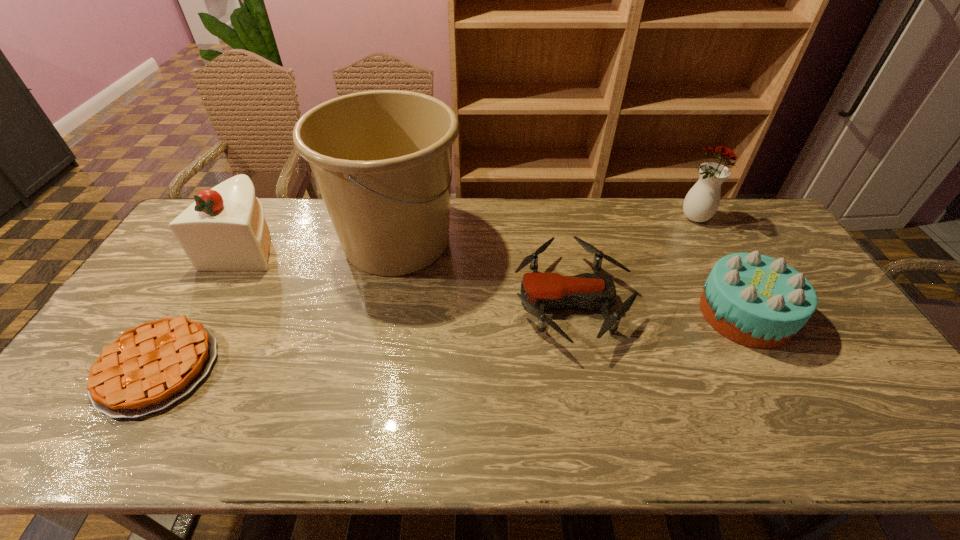
Locate an element on the screen. bucket is located at coordinates (381, 159).

Identify the location of the fourth object from right to left. (381, 159).

Locate an element on the screen. The image size is (960, 540). vase is located at coordinates (702, 201).

Identify the location of the left cake. tap(224, 229).

Locate an element on the screen. the farther cake is located at coordinates (224, 229).

You are a GUI agent. You are given a task and a screenshot of the screen. Output one action in this format:
    pyautogui.click(x=<x>, y=<y>)
    Task: Click on the right cake
    The image size is (960, 540).
    Given the screenshot: What is the action you would take?
    757,301

Locate an element on the screen. the nearer cake is located at coordinates (757, 301).

Image resolution: width=960 pixels, height=540 pixels. Find the location of `drone`. drone is located at coordinates [x=539, y=291].

Locate an element on the screen. the fifth tallest object is located at coordinates (539, 291).

At what (x,y) coordinates should I click in order to perform the action: click on pie. Please return your answer as a coordinate pair (x, y). The width and height of the screenshot is (960, 540). Looking at the image, I should click on (147, 368).